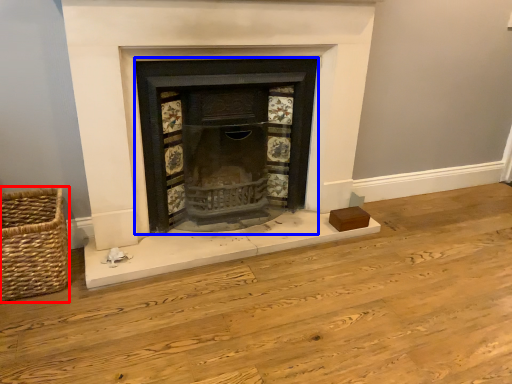
Question: Among these objects, which one is farthest to the camera, basket (highlighted by a red box) or wood burning stove (highlighted by a blue box)?

Choices:
 (A) basket
 (B) wood burning stove

Answer: (B)